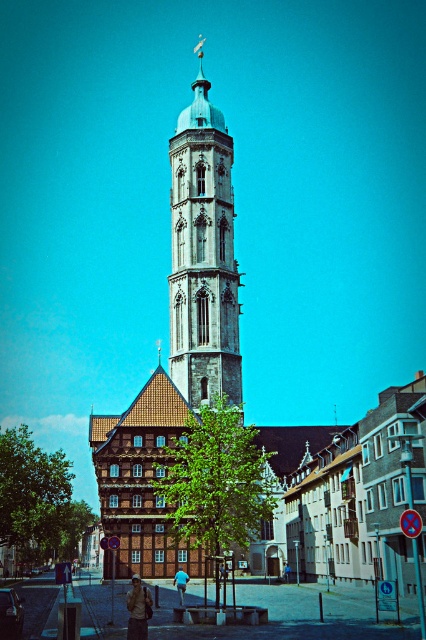
You are a tailor who needs to determine which clothing item requires more fabric to repair. You see a camouflage jacket at lower center and a blue cotton shirt at center. Which one needs more fabric?

The camouflage jacket at lower center requires more fabric for repair because it is bigger than the blue cotton shirt at center.

You are standing in the urban scene and want to take a photo of the tower. You notice two points marked in the image. Which point, point (229, 486) or point (37, 488), is closer to your camera lens?

Point (229, 486) is closer to the camera lens than point (37, 488).

You are a tourist standing in front of the blue stone tower at center and the green leafy tree at lower left. Which object is closer to you?

The blue stone tower at center is closer to you because the green leafy tree at lower left is behind it.